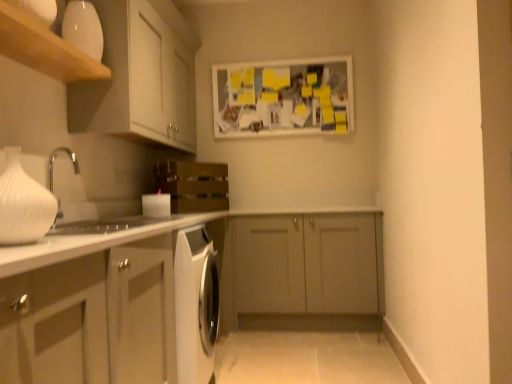
Image resolution: width=512 pixels, height=384 pixels. What do you see at coordinates (306, 264) in the screenshot?
I see `matte gray cabinet at center, which ranks as the second cabinetry in bottom-to-top order` at bounding box center [306, 264].

What do you see at coordinates (23, 203) in the screenshot? I see `white matte vase at left` at bounding box center [23, 203].

Image resolution: width=512 pixels, height=384 pixels. In order to click on wooden crate at center in this screenshot , I will do `click(193, 185)`.

Where is `white matte cabinet at lower left, positioned as the third cabinetry in top-to-bottom order`? The image size is (512, 384). white matte cabinet at lower left, positioned as the third cabinetry in top-to-bottom order is located at coordinates (92, 319).

Image resolution: width=512 pixels, height=384 pixels. What are the coordinates of `matte gray cabinet at center, which ranks as the second cabinetry in bottom-to-top order` in the screenshot? It's located at [x=306, y=264].

Which is in front, white matte cabinet at lower left, positioned as the third cabinetry in top-to-bottom order, or white glossy sink at left?

white matte cabinet at lower left, positioned as the third cabinetry in top-to-bottom order.

Is white matte cabinet at lower left, marked as the first cabinetry in a bottom-to-top arrangement, positioned far away from white glossy sink at left?

No, white matte cabinet at lower left, marked as the first cabinetry in a bottom-to-top arrangement, is in close proximity to white glossy sink at left.

Image resolution: width=512 pixels, height=384 pixels. I want to click on sink that is above the white matte cabinet at lower left, marked as the first cabinetry in a bottom-to-top arrangement (from the image's perspective), so click(97, 217).

Between point (62, 307) and point (101, 229), which one is positioned behind?

Positioned behind is point (101, 229).

From a real-world perspective, is wooden shelf at upper left on wooden crate at center?

Yes, from a real-world perspective, wooden shelf at upper left is above wooden crate at center.

Is wooden shelf at upper left facing towards wooden crate at center?

No, wooden shelf at upper left is not oriented towards wooden crate at center.

Which object is further away from the camera taking this photo, wooden shelf at upper left or wooden crate at center?

wooden crate at center is more distant.

Is white matte cabinet at lower left, marked as the first cabinetry in a bottom-to-top arrangement, next to wooden shelf at upper left and touching it?

No, white matte cabinet at lower left, marked as the first cabinetry in a bottom-to-top arrangement, is not beside wooden shelf at upper left.

From the image's perspective, which is below, white matte cabinet at lower left, positioned as the third cabinetry in top-to-bottom order, or wooden shelf at upper left?

white matte cabinet at lower left, positioned as the third cabinetry in top-to-bottom order, is shown below in the image.

Is white matte cabinet at lower left, positioned as the third cabinetry in top-to-bottom order, oriented away from wooden shelf at upper left?

white matte cabinet at lower left, positioned as the third cabinetry in top-to-bottom order, is not turned away from wooden shelf at upper left.

Who is taller, white matte cabinet at lower left, marked as the first cabinetry in a bottom-to-top arrangement, or wooden shelf at upper left?

Standing taller between the two is white matte cabinet at lower left, marked as the first cabinetry in a bottom-to-top arrangement.

Is white matte bulletin board at upper center in front of or behind wooden crate at center in the image?

In the image, white matte bulletin board at upper center appears behind wooden crate at center.

Which object is positioned more to the right, white matte bulletin board at upper center or wooden crate at center?

Positioned to the right is white matte bulletin board at upper center.

Is white matte bulletin board at upper center thinner than wooden crate at center?

Correct, the width of white matte bulletin board at upper center is less than that of wooden crate at center.

Between white matte bulletin board at upper center and wooden crate at center, which one has less height?

wooden crate at center.

Who is shorter, white matte bulletin board at upper center or white matte cabinet at lower left, marked as the first cabinetry in a bottom-to-top arrangement?

With less height is white matte bulletin board at upper center.

Based on the photo, which object is more forward, white matte bulletin board at upper center or white matte cabinet at lower left, positioned as the third cabinetry in top-to-bottom order?

white matte cabinet at lower left, positioned as the third cabinetry in top-to-bottom order, is closer to the camera.

From the image's perspective, which one is positioned lower, white matte bulletin board at upper center or white matte cabinet at lower left, positioned as the third cabinetry in top-to-bottom order?

white matte cabinet at lower left, positioned as the third cabinetry in top-to-bottom order, from the image's perspective.

Is white matte bulletin board at upper center not inside white matte cabinet at lower left, positioned as the third cabinetry in top-to-bottom order?

Yes, white matte bulletin board at upper center is located beyond the bounds of white matte cabinet at lower left, positioned as the third cabinetry in top-to-bottom order.

Based on the photo, measure the distance between matte gray cabinet at center, which ranks as the second cabinetry in bottom-to-top order, and white matte bulletin board at upper center.

matte gray cabinet at center, which ranks as the second cabinetry in bottom-to-top order, is 37.84 inches away from white matte bulletin board at upper center.

In the scene shown: Is matte gray cabinet at center, acting as the 2th cabinetry starting from the top, beside white matte bulletin board at upper center?

They are not placed beside each other.

Relative to white matte bulletin board at upper center, is matte gray cabinet at center, acting as the 2th cabinetry starting from the top, in front or behind?

Clearly, matte gray cabinet at center, acting as the 2th cabinetry starting from the top, is in front of white matte bulletin board at upper center.

Which is in front, point (304, 276) or point (283, 99)?

The point (304, 276) is in front.

From a real-world perspective, which object stands above the other?

In real-world perspective, white matte bulletin board at upper center is above.

How much distance is there between white matte bulletin board at upper center and white matte vase at left?

A distance of 7.71 feet exists between white matte bulletin board at upper center and white matte vase at left.

Is white matte bulletin board at upper center to the right of white matte vase at left from the viewer's perspective?

Indeed, white matte bulletin board at upper center is positioned on the right side of white matte vase at left.

Does point (222, 113) lie in front of point (2, 178)?

No, (222, 113) is further to viewer.

Where is `sink behind the white matte cabinet at lower left, marked as the first cabinetry in a bottom-to-top arrangement`? sink behind the white matte cabinet at lower left, marked as the first cabinetry in a bottom-to-top arrangement is located at coordinates (97, 217).

Where is `oven lying below the wooden shelf at upper left (from the image's perspective)`? This screenshot has height=384, width=512. oven lying below the wooden shelf at upper left (from the image's perspective) is located at coordinates (193, 185).

When comparing their distances from wooden shelf at upper left, does white matte cabinet at upper left, marked as the third cabinetry in a bottom-to-top arrangement, or white matte vase at left seem closer?

white matte cabinet at upper left, marked as the third cabinetry in a bottom-to-top arrangement, is closer to wooden shelf at upper left.

Considering their positions, is white matte bulletin board at upper center positioned further to wooden crate at center than white matte cabinet at lower left, marked as the first cabinetry in a bottom-to-top arrangement?

white matte cabinet at lower left, marked as the first cabinetry in a bottom-to-top arrangement, is positioned further to the anchor wooden crate at center.

Which object lies nearer to the anchor point white matte bulletin board at upper center, white matte cabinet at upper left, marked as the third cabinetry in a bottom-to-top arrangement, or wooden crate at center?

Based on the image, wooden crate at center appears to be nearer to white matte bulletin board at upper center.

Estimate the real-world distances between objects in this image. Which object is closer to white matte bulletin board at upper center, white matte cabinet at upper left, positioned as the first cabinetry in top-to-bottom order, or matte gray cabinet at center, acting as the 2th cabinetry starting from the top?

white matte cabinet at upper left, positioned as the first cabinetry in top-to-bottom order, lies closer to white matte bulletin board at upper center than the other object.

When comparing their distances from matte gray cabinet at center, acting as the 2th cabinetry starting from the top, does wooden crate at center or white matte vase at left seem further?

white matte vase at left is positioned further to the anchor matte gray cabinet at center, acting as the 2th cabinetry starting from the top.

Considering their positions, is wooden shelf at upper left positioned further to white matte bulletin board at upper center than white matte vase at left?

white matte vase at left.

Estimate the real-world distances between objects in this image. Which object is further from white glossy sink at left, wooden shelf at upper left or matte gray cabinet at center, which ranks as the second cabinetry in bottom-to-top order?

Based on the image, matte gray cabinet at center, which ranks as the second cabinetry in bottom-to-top order, appears to be further to white glossy sink at left.

From the picture: Which object lies nearer to the anchor point wooden shelf at upper left, white matte vase at left or wooden crate at center?

white matte vase at left is closer to wooden shelf at upper left.

Locate an element on the screen. shelf between white matte vase at left and white glossy sink at left from front to back is located at coordinates (44, 48).

The image size is (512, 384). What are the coordinates of `cabinetry positioned between white matte vase at left and white glossy sink at left from near to far` in the screenshot? It's located at (92, 319).

In order to click on bulletin board between white matte cabinet at upper left, marked as the third cabinetry in a bottom-to-top arrangement, and white matte cabinet at lower left, positioned as the third cabinetry in top-to-bottom order, in the vertical direction in this screenshot , I will do `click(283, 97)`.

This screenshot has height=384, width=512. What are the coordinates of `oven positioned between white matte vase at left and matte gray cabinet at center, which ranks as the second cabinetry in bottom-to-top order, from near to far` in the screenshot? It's located at (193, 185).